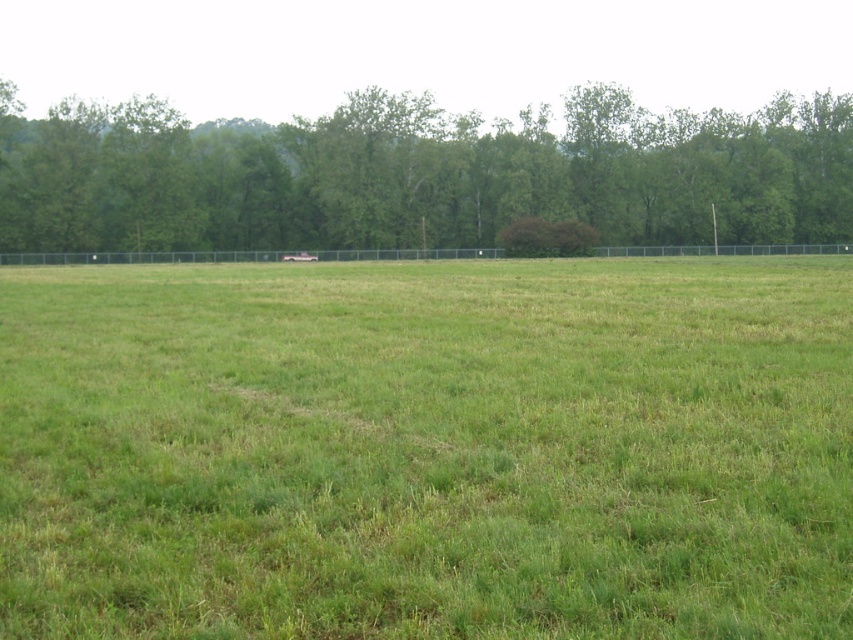
Who is positioned more to the right, green grassy field at center or green leafy tree at upper center?

green leafy tree at upper center

Can you confirm if green grassy field at center is positioned to the right of green leafy tree at upper center?

Incorrect, green grassy field at center is not on the right side of green leafy tree at upper center.

The width and height of the screenshot is (853, 640). What do you see at coordinates (427, 449) in the screenshot?
I see `green grassy field at center` at bounding box center [427, 449].

I want to click on green grassy field at center, so click(x=427, y=449).